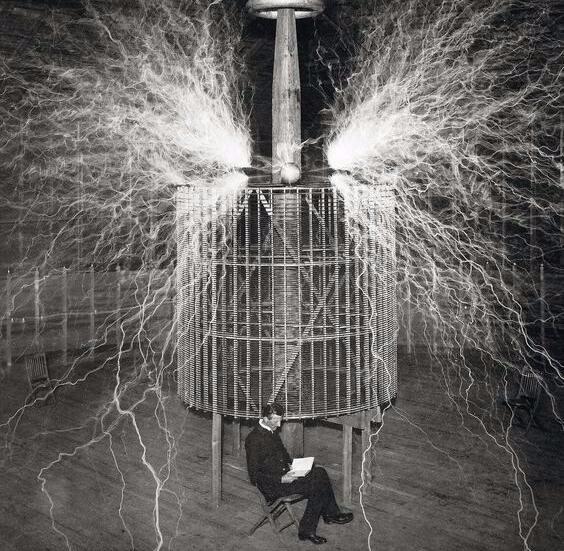
Identify the location of book. The image size is (564, 551). (302, 471).